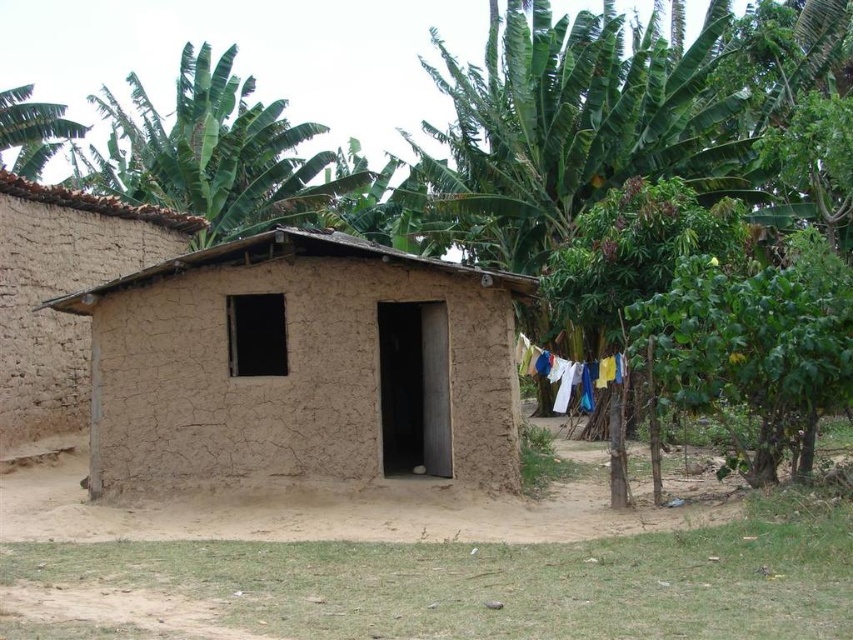
Does green leafy banana tree at upper left appear over green leafy tree at upper left?

Actually, green leafy banana tree at upper left is below green leafy tree at upper left.

This screenshot has width=853, height=640. What do you see at coordinates (212, 154) in the screenshot? I see `green leafy banana tree at upper left` at bounding box center [212, 154].

The width and height of the screenshot is (853, 640). Find the location of `green leafy banana tree at upper left`. green leafy banana tree at upper left is located at coordinates (212, 154).

Identify the location of green leafy banana tree at upper left. (212, 154).

Where is `green leafy tree at upper left`? This screenshot has width=853, height=640. green leafy tree at upper left is located at coordinates (32, 131).

Identify the location of green leafy tree at upper left. (32, 131).

Does green leafy banana tree at upper left appear over white fabric at center?

Correct, green leafy banana tree at upper left is located above white fabric at center.

Is green leafy banana tree at upper left to the right of white fabric at center from the viewer's perspective?

Result: No, green leafy banana tree at upper left is not to the right of white fabric at center.

What do you see at coordinates (212, 154) in the screenshot?
I see `green leafy banana tree at upper left` at bounding box center [212, 154].

This screenshot has height=640, width=853. What are the coordinates of `green leafy banana tree at upper left` in the screenshot? It's located at (212, 154).